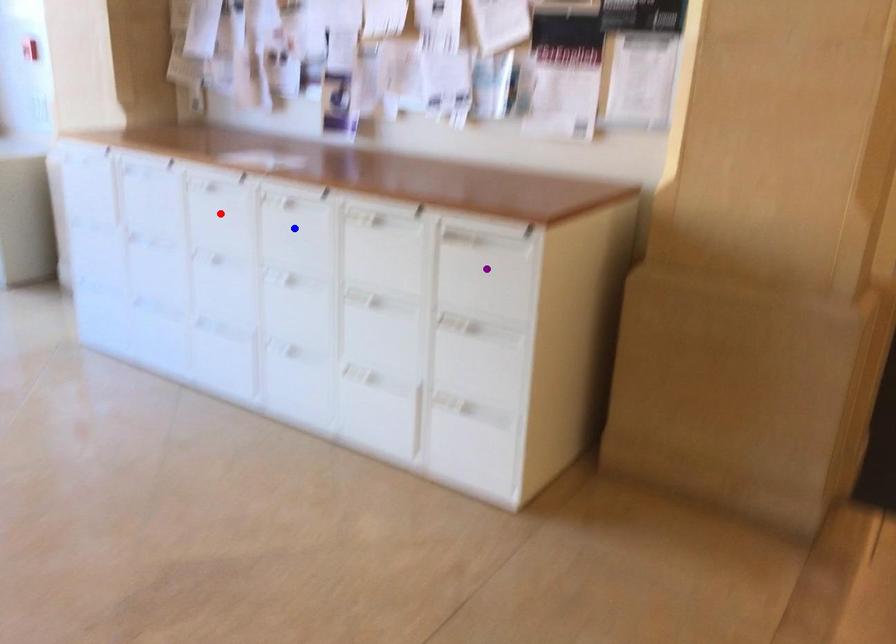
Order these from nearest to farthest:
blue point | red point | purple point

1. red point
2. blue point
3. purple point